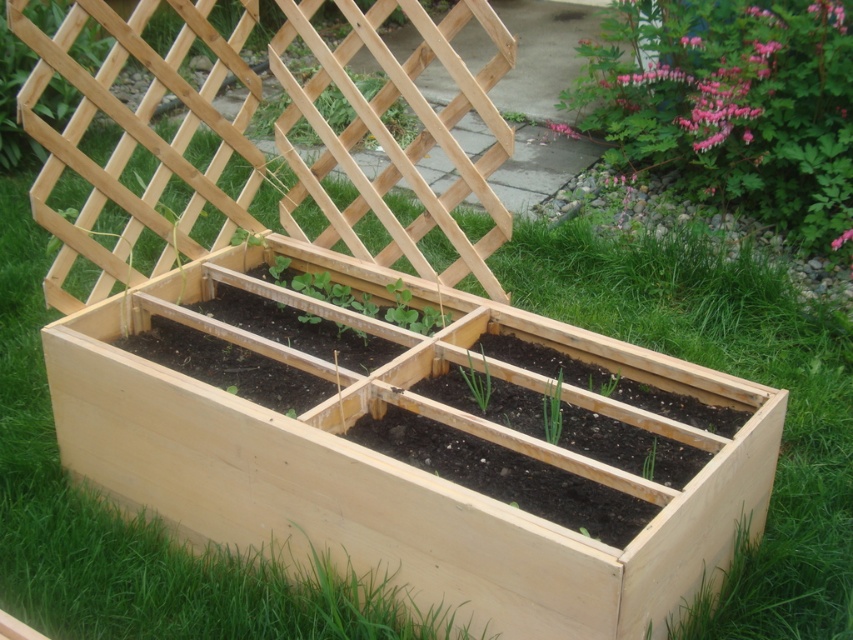
You are a gardener who wants to plant a new green matte onion at center in the garden bed. You notice the green matte trellis at upper center. Which object is closer to you, the gardener, when standing at the edge of the garden bed?

The green matte trellis at upper center is closer to you than the green matte onion at center because it is further to the viewer.

You are a gardener who wants to install a new irrigation system. The system requires a minimum distance of 2 meters between the water nozzle and any plant to avoid overwatering. You have a nozzle placed at the green matte trellis at upper center. Will the green matte plant at lower right be within the safe distance?

The green matte trellis at upper center and green matte plant at lower right are 2.67 meters apart. Since the required minimum distance is 2 meters, the plant is within the safe distance and will receive adequate water without overwatering.

You are planning to install a new trellis in your garden. You have a green matte trellis at upper center and a green matte plant at lower right. Which object is positioned to the left of the other?

The green matte trellis at upper center is to the left of the green matte plant at lower right.